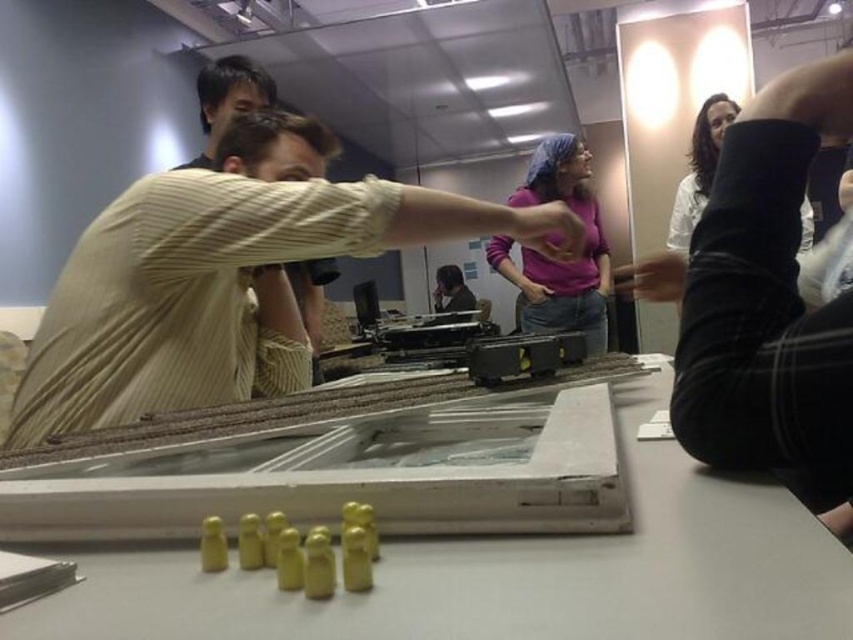
Is point (235, 67) farther from camera compared to point (804, 221)?

No, (235, 67) is closer to viewer.

Is light beige striped shirt at upper left below black leather boot at upper right?

Correct, light beige striped shirt at upper left is located below black leather boot at upper right.

At what (x,y) coordinates should I click in order to perform the action: click on light beige striped shirt at upper left. Please return your answer as a coordinate pair (x, y). Looking at the image, I should click on (228, 99).

Between black knit sweater at upper right and matte black shirt at center, which one has more height?

Standing taller between the two is black knit sweater at upper right.

Does black knit sweater at upper right have a lesser width compared to matte black shirt at center?

Indeed, black knit sweater at upper right has a lesser width compared to matte black shirt at center.

Between point (846, 420) and point (457, 292), which one is positioned behind?

Positioned behind is point (457, 292).

At what (x,y) coordinates should I click in order to perform the action: click on black knit sweater at upper right. Please return your answer as a coordinate pair (x, y). The height and width of the screenshot is (640, 853). Looking at the image, I should click on coord(770,301).

Does black knit sweater at upper right have a lesser height compared to purple matte shirt at center?

Yes.

Does point (698, 412) come closer to viewer compared to point (527, 189)?

Yes, it is in front of point (527, 189).

Which is behind, point (828, 422) or point (604, 289)?

The point (604, 289) is more distant.

Where is `black knit sweater at upper right`? black knit sweater at upper right is located at coordinates (770, 301).